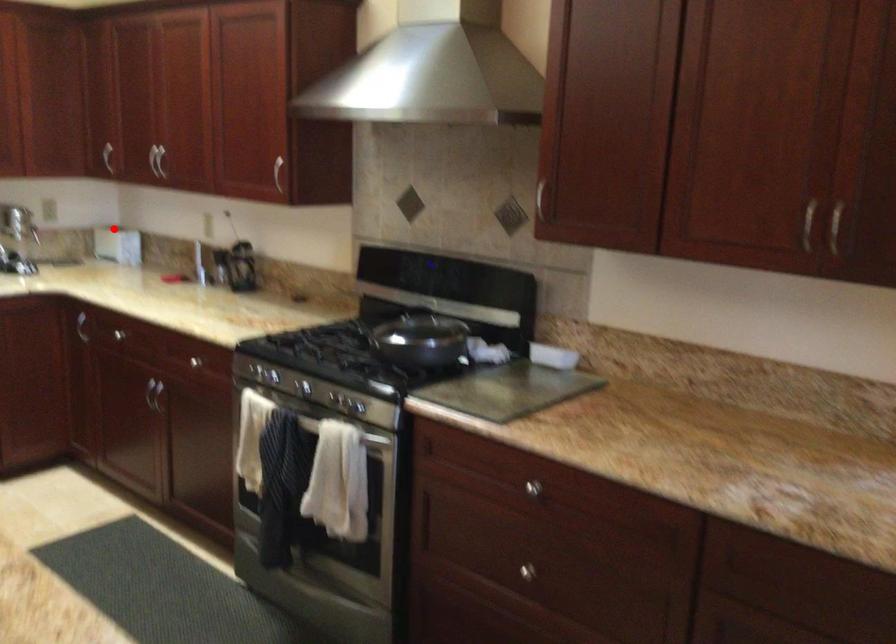
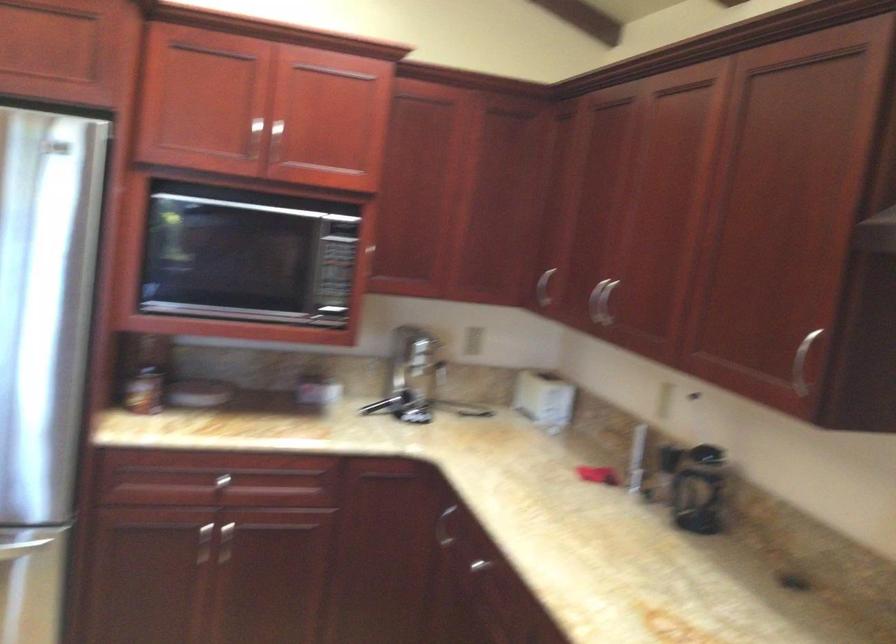
Question: I am providing you with two images of the same scene from different viewpoints. Given a red point in image1, look at the same physical point in image2. Is it:

Choices:
 (A) Closer to the viewpoint
 (B) Farther from the viewpoint

Answer: (A)